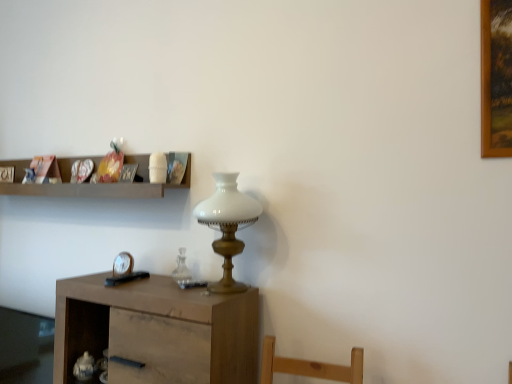
Question: Is wooden cabinet at center to the left or to the right of wooden shelf at upper center in the image?

Choices:
 (A) right
 (B) left

Answer: (A)

Question: Is point (199, 340) positioned closer to the camera than point (11, 185)?

Choices:
 (A) closer
 (B) farther

Answer: (A)

Question: Estimate the real-world distances between objects in this image. Which object is farther from the metallic silver clock at lower left?

Choices:
 (A) transparent glass cabinet at lower left
 (B) wooden cabinet at center
 (C) wooden picture frame at upper left, the second picture frame in the front-to-back sequence
 (D) metallic silver picture frame at upper center, positioned as the second picture frame in left-to-right order
 (E) wooden shelf at upper center

Answer: (C)

Question: Based on their relative distances, which object is farther from the metallic silver clock at lower left?

Choices:
 (A) transparent glass cabinet at lower left
 (B) metallic silver picture frame at upper center, which appears as the first picture frame when viewed from the right
 (C) clear glass vase at center
 (D) white glass table lamp at center
 (E) wooden shelf at upper center

Answer: (A)